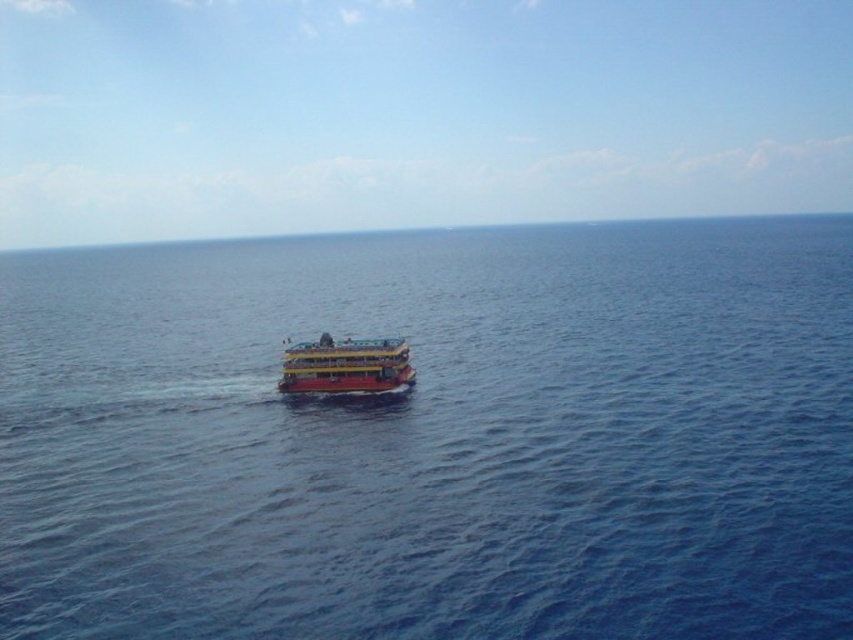
You are a sailor navigating a ship and want to reach the point at coordinates point (x=746, y=324) and point (x=323, y=355). Which point is closer to your current position at the center of the image?

Point (x=323, y=355) is closer to the center of the image than point (x=746, y=324) because it is in front of it.

You are a sailor navigating a boat and you want to check the depth of the water at the point marked as point (x=434, y=436). According to the image, what is located at that point?

The point (x=434, y=436) is occupied by blue water at center, so the depth cannot be determined from the image as it only specifies the location contains water.

Based on the photo, you are a photographer trying to capture the blue water at center and the yellow matte boat at center in a single frame. Which object will occupy more space in your photo?

The blue water at center is bigger than the yellow matte boat at center, so it will occupy more space in the photo.